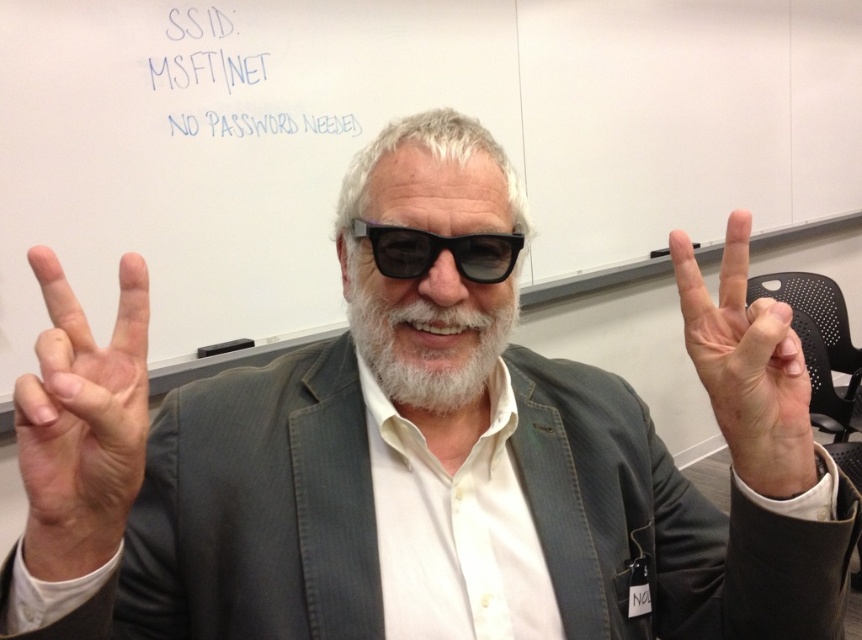
You are a photographer trying to capture the man in the scene. You need to focus your camera on the pink flesh at center and the black matte glasses at center. Which object should you adjust your focus to first if you want to ensure both are in focus?

The pink flesh at center is positioned on the right side of black matte glasses at center. To ensure both are in focus, you should focus on the black matte glasses at center first since it is closer to the camera, then adjust the focus outward to include the pink flesh at center.

What is located at the coordinate point (247, 77) in the image?

The blue ink writing at upper left is located at the coordinate point (247, 77).